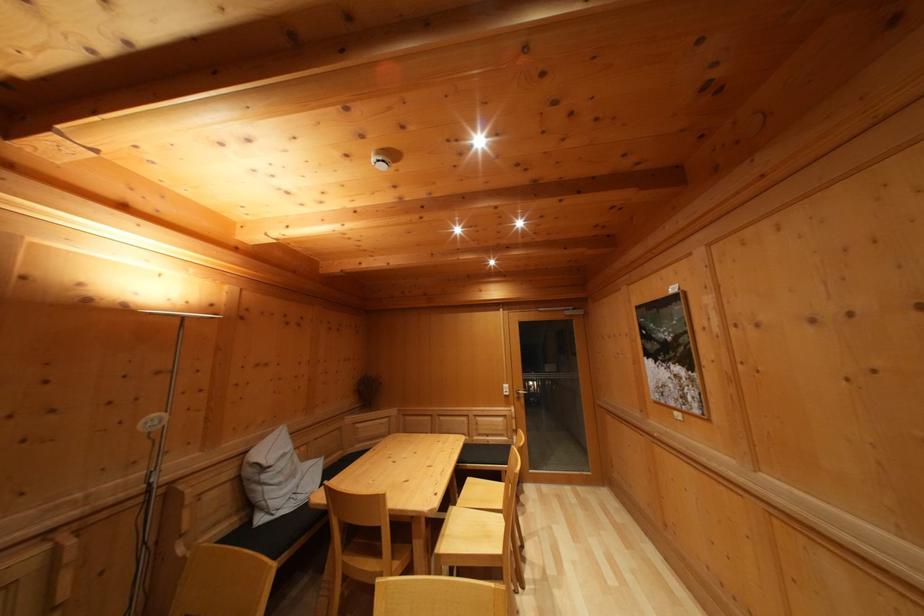
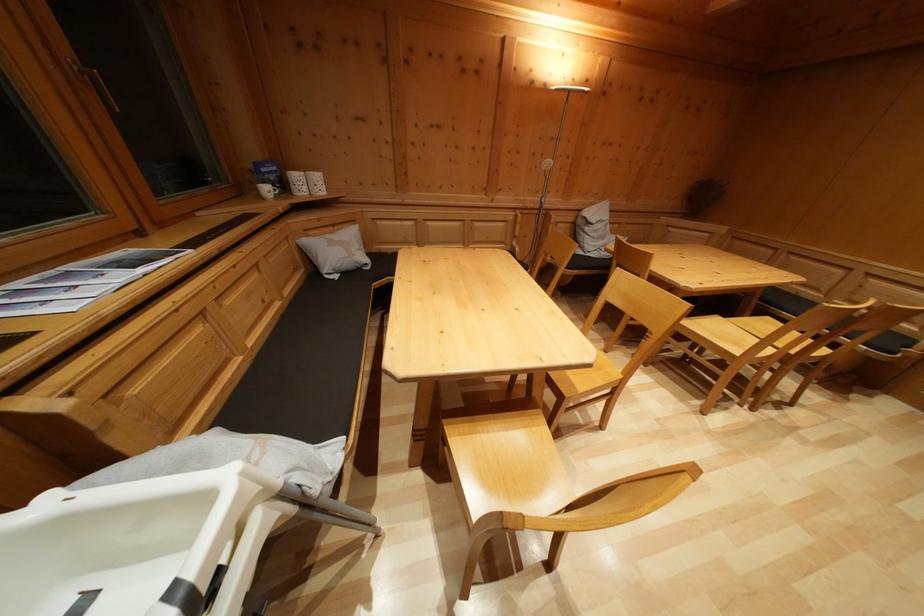
Based on the photo, based on the continuous images, in which direction is the camera rotating?

The camera rotated toward left-down.